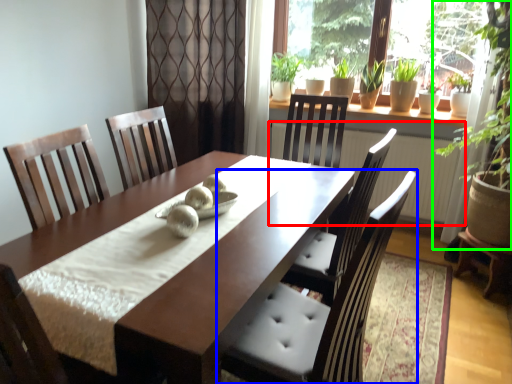
Question: Estimate the real-world distances between objects in this image. Which object is closer to radiator (highlighted by a red box), chair (highlighted by a blue box) or houseplant (highlighted by a green box)?

Choices:
 (A) chair
 (B) houseplant

Answer: (B)